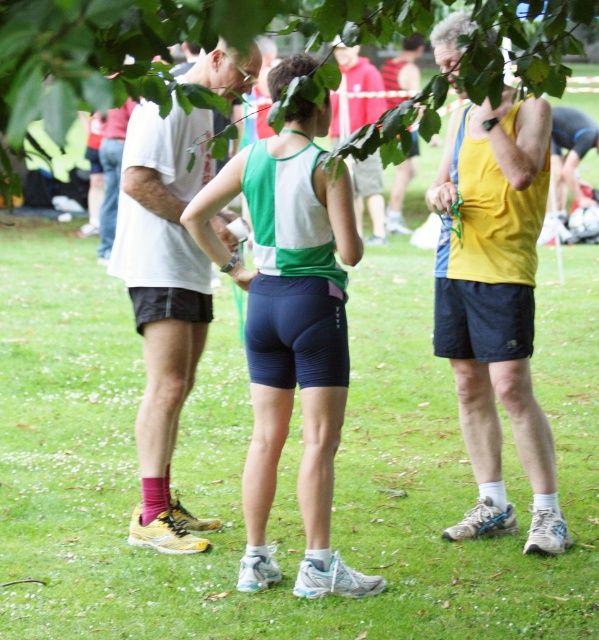
You are a photographer taking a picture of the matte green and white tank top at center and the green leafy tree at upper center. Which object is higher in the frame?

The green leafy tree at upper center is higher in the frame than the matte green and white tank top at center.

You are organizing a photo shoot and need to ensure that the green jersey at center and the yellow tank top at center are visible in the frame. Given their sizes, which one might require more space to fully capture in the photo?

The green jersey at center has a larger width than the yellow tank top at center, so it would require more space to fully capture in the photo.